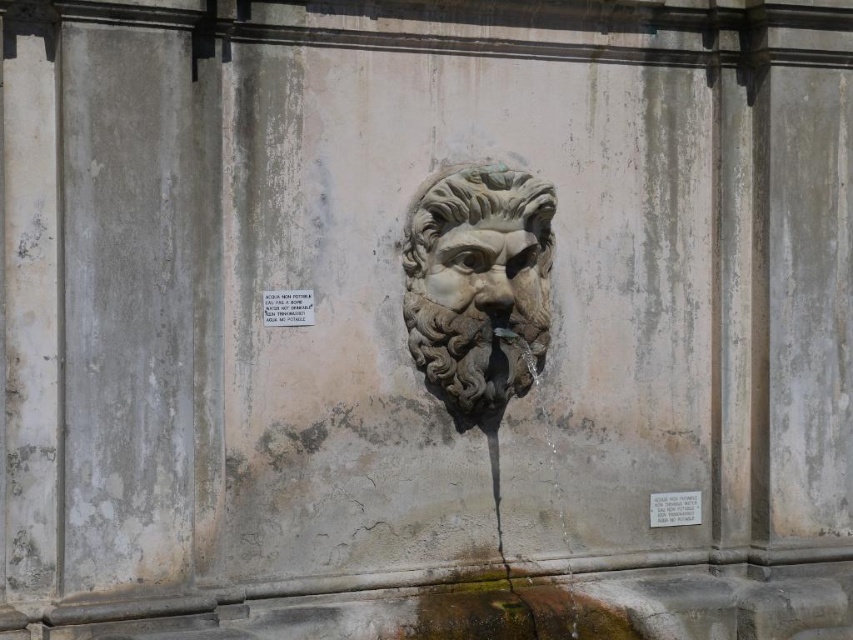
You are standing in front of the stone wall with the sculpted face and the flowing water. There are two points marked on the wall at coordinates point (416, 324) and point (483, 273). Which point is closer to you?

Point (416, 324) is in front of point (483, 273), so it is closer to you.

You are standing in front of the stone wall with the sculpted face. You notice two points marked on the wall at coordinates point (521, 243) and point (686, 524). If you were to reach out and touch both points, which one would feel closer to your hand?

Point (521, 243) is closer to the camera than point (686, 524), so touching point (521, 243) would feel closer to your hand.

You are standing in front of the weathered stone wall with the sculpted face and water flowing from its mouth. You notice a point marked at coordinates (287, 307). What object is located at this coordinate?

The point at coordinates (287, 307) indicates the location of the white stone plaque at upper center.